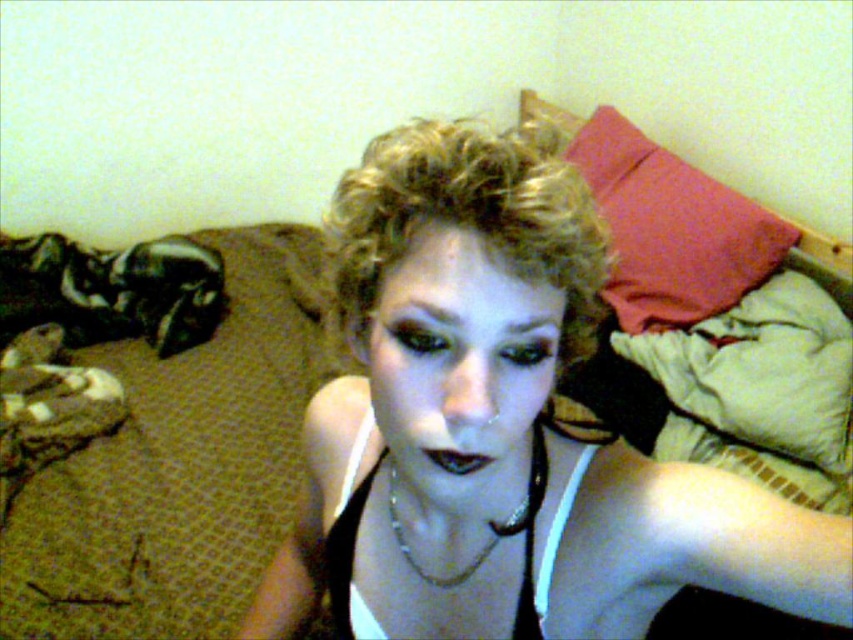
Which is below, matte black tank top at center or blonde curly hair at center?

Positioned lower is matte black tank top at center.

Is matte black tank top at center bigger than blonde curly hair at center?

Indeed, matte black tank top at center has a larger size compared to blonde curly hair at center.

Which is behind, point (717, 564) or point (592, 317)?

The point (717, 564) is behind.

What are the coordinates of `matte black tank top at center` in the screenshot? It's located at (502, 428).

Who is taller, matte black tank top at center or silver metallic chain at center?

With more height is matte black tank top at center.

Between matte black tank top at center and silver metallic chain at center, which one is positioned lower?

Positioned lower is matte black tank top at center.

Which is behind, point (544, 301) or point (491, 541)?

The point (491, 541) is behind.

Identify the location of matte black tank top at center. This screenshot has width=853, height=640. (502, 428).

Which is more to the left, matte black tank top at center or red fabric pillow at upper right?

Positioned to the left is matte black tank top at center.

Is matte black tank top at center behind red fabric pillow at upper right?

No.

Between point (670, 586) and point (732, 273), which one is positioned in front?

Point (670, 586) is in front.

Where is `matte black tank top at center`? The width and height of the screenshot is (853, 640). matte black tank top at center is located at coordinates (502, 428).